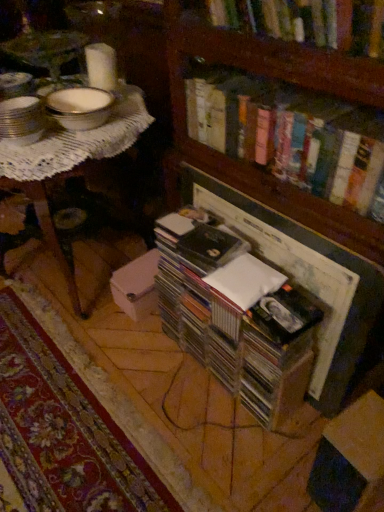
The image size is (384, 512). I want to click on vacant area that lies to the right of metallic silver bowls at upper left, so click(65, 144).